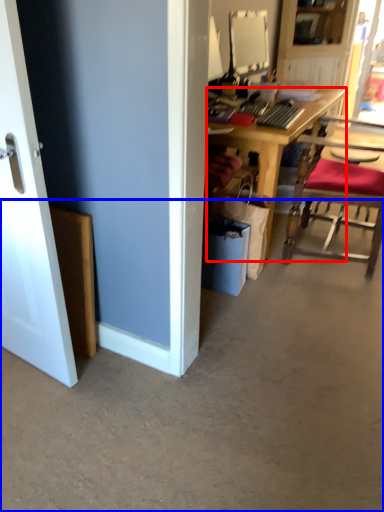
Question: Among these objects, which one is farthest to the camera, desk (highlighted by a red box) or concrete (highlighted by a blue box)?

Choices:
 (A) desk
 (B) concrete

Answer: (A)